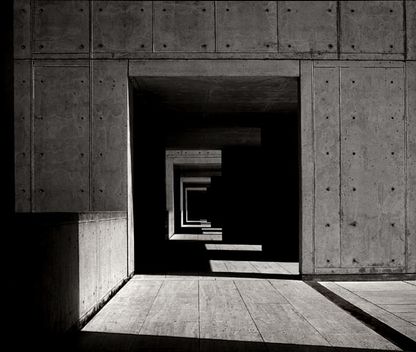
Look for where the table and wall connects in the image and show me where they are. Your answer should be formatted as a list of tuples, i.e. [(x1, y1), (x2, y2), ...], where each tuple contains the x and y coordinates of a point satisfying the conditions above.

[(125, 212)]